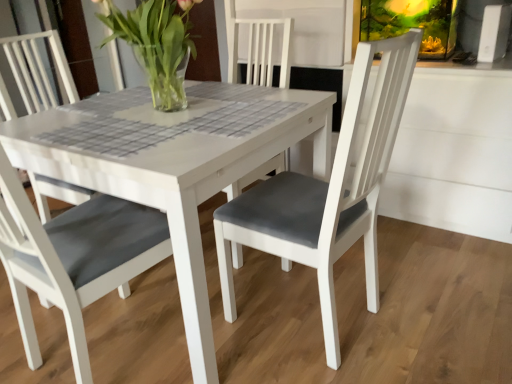
At what (x,y) coordinates should I click in order to perform the action: click on vacant space underneath clear glass vase at center (from a real-world perspective). Please return your answer as a coordinate pair (x, y). This screenshot has height=384, width=512. Looking at the image, I should click on (178, 109).